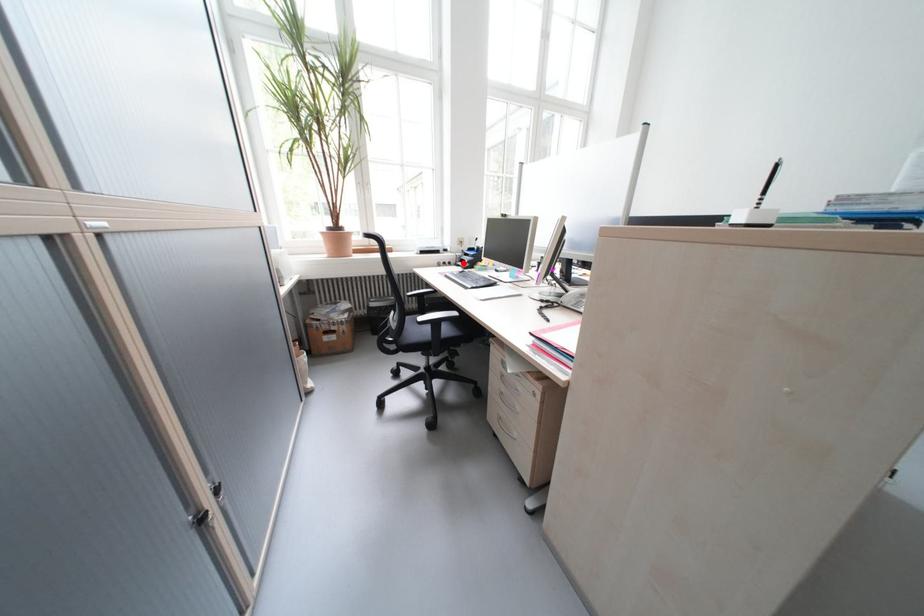
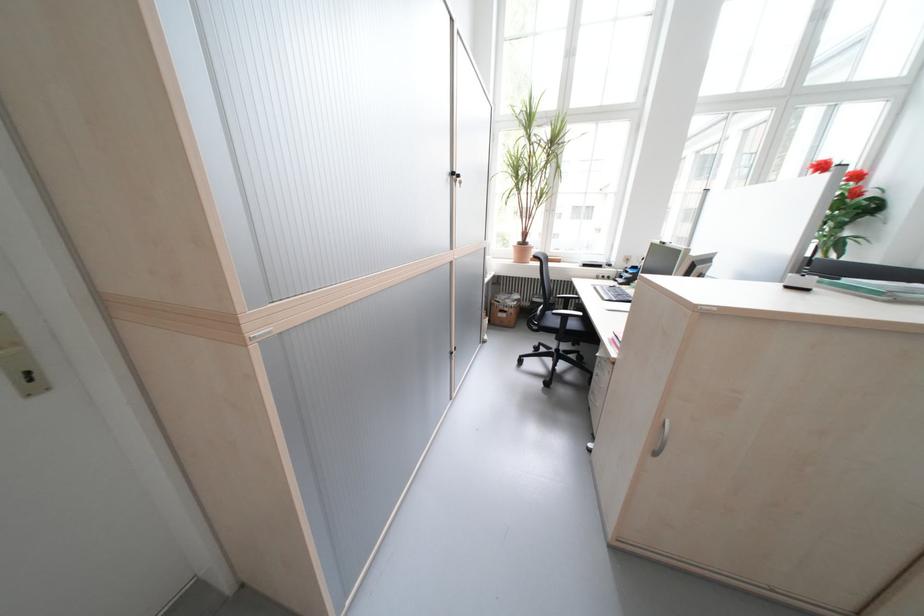
Locate, in the second image, the point that corresponds to the highlighted location in the first image.

(623, 278)